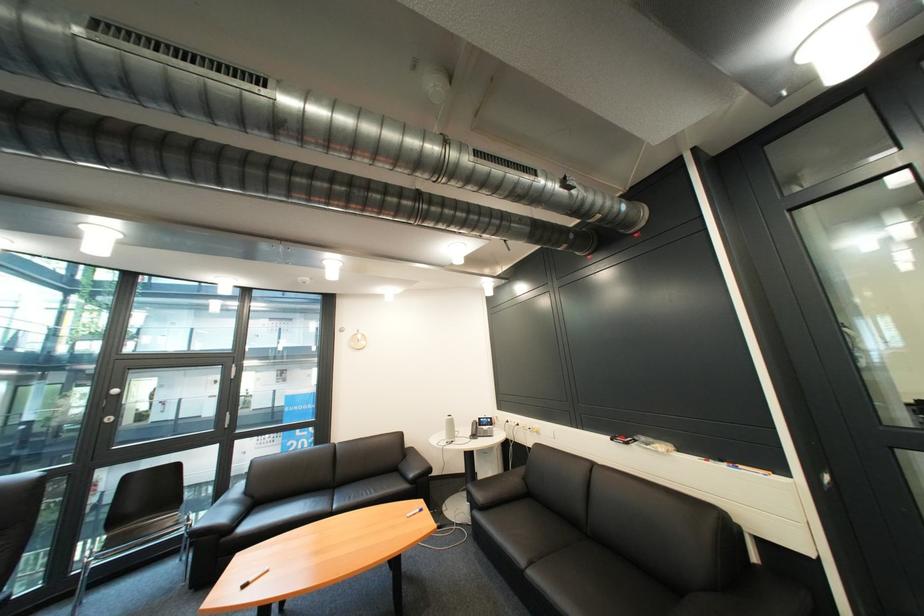
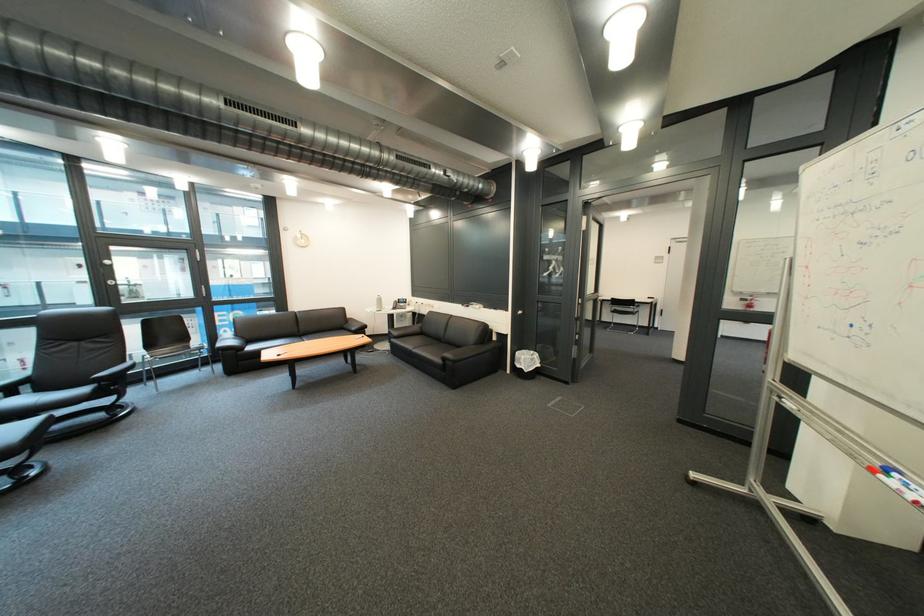
The point at (796,474) is marked in the first image. Where is the corresponding point in the second image?

(520, 312)